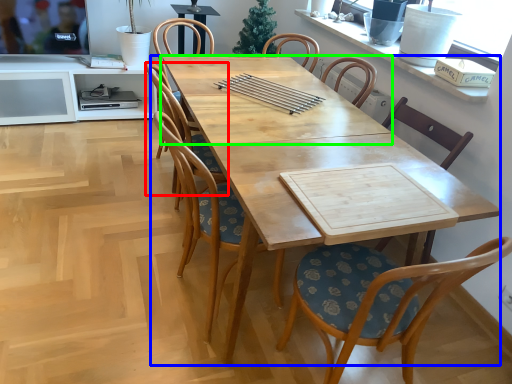
Question: Estimate the real-world distances between objects in this image. Which object is farther from chair (highlighted by a red box), desk (highlighted by a blue box) or kitchen & dining room table (highlighted by a green box)?

Choices:
 (A) desk
 (B) kitchen & dining room table

Answer: (A)